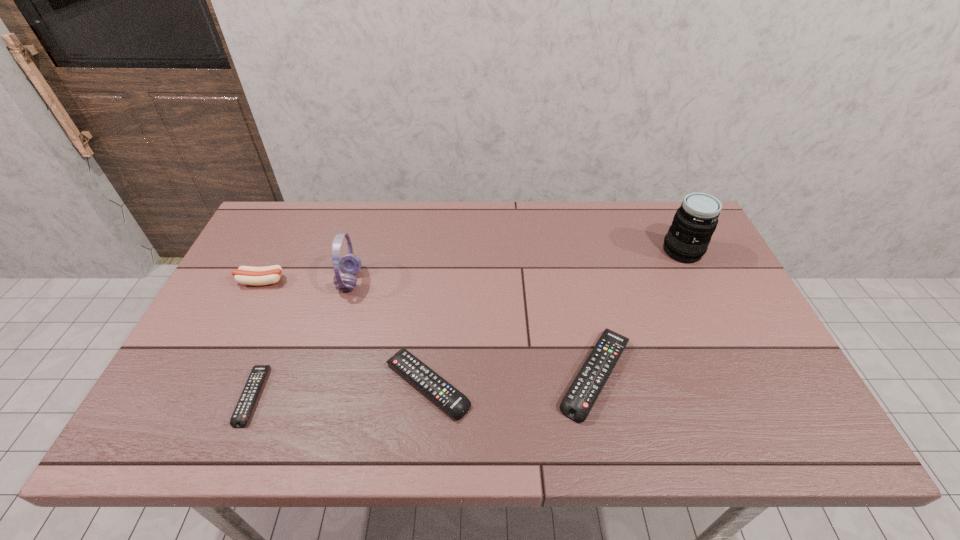
Locate an element on the screen. The width and height of the screenshot is (960, 540). vacant region located on the back of the leftmost remote control is located at coordinates (302, 272).

Where is `vacant point located on the right of the third object from right to left`? This screenshot has width=960, height=540. vacant point located on the right of the third object from right to left is located at coordinates coord(590,384).

You are a GUI agent. You are given a task and a screenshot of the screen. Output one action in this format:
    pyautogui.click(x=<x>, y=<y>)
    Task: Click on the vacant space located 0.380m on the left of the second object from right to left
    This screenshot has width=960, height=540.
    Given the screenshot: What is the action you would take?
    pyautogui.click(x=396, y=374)

Identify the location of vacant space located on the front of the telephoto lens. (743, 377).

You are a GUI agent. You are given a task and a screenshot of the screen. Output one action in this format:
    pyautogui.click(x=<x>, y=<y>)
    Task: Click on the vacant space located 0.350m on the front of the leftmost object
    The image size is (960, 540).
    Given the screenshot: What is the action you would take?
    pyautogui.click(x=204, y=399)

Identify the location of vacant space positioned 0.170m on the headband and ear cups of the fifth shortest object. (420, 281).

Identify the location of object at the far edge. (687, 240).

Where is `object located in the left edge section of the desktop`? object located in the left edge section of the desktop is located at coordinates (247, 275).

Locate an element on the screen. object located in the right edge section of the desktop is located at coordinates (687, 240).

You are a GUI agent. You are given a task and a screenshot of the screen. Output one action in this format:
    pyautogui.click(x=<x>, y=<y>)
    Task: Click on the object located at the far right corner
    The width and height of the screenshot is (960, 540).
    Given the screenshot: What is the action you would take?
    (687, 240)